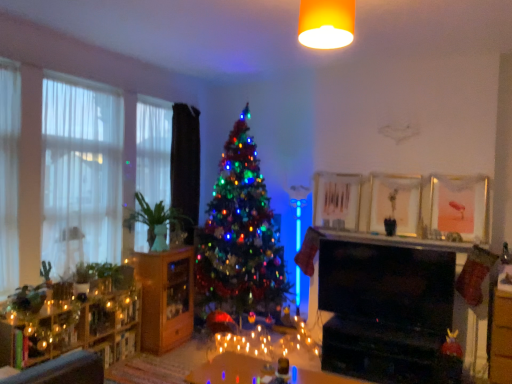
The image size is (512, 384). What are the coordinates of `free space above white sheer curtains at left, marked as the 1th window in a front-to-back arrangement (from a real-world perspective)` in the screenshot? It's located at (78, 77).